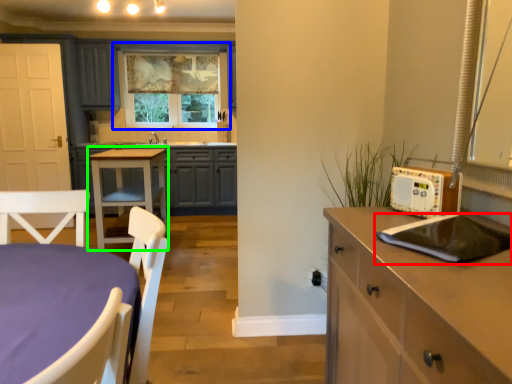
Question: Estimate the real-world distances between objects in this image. Which object is closer to kitchen appliance (highlighted by a red box), window (highlighted by a blue box) or table (highlighted by a green box)?

Choices:
 (A) window
 (B) table

Answer: (B)